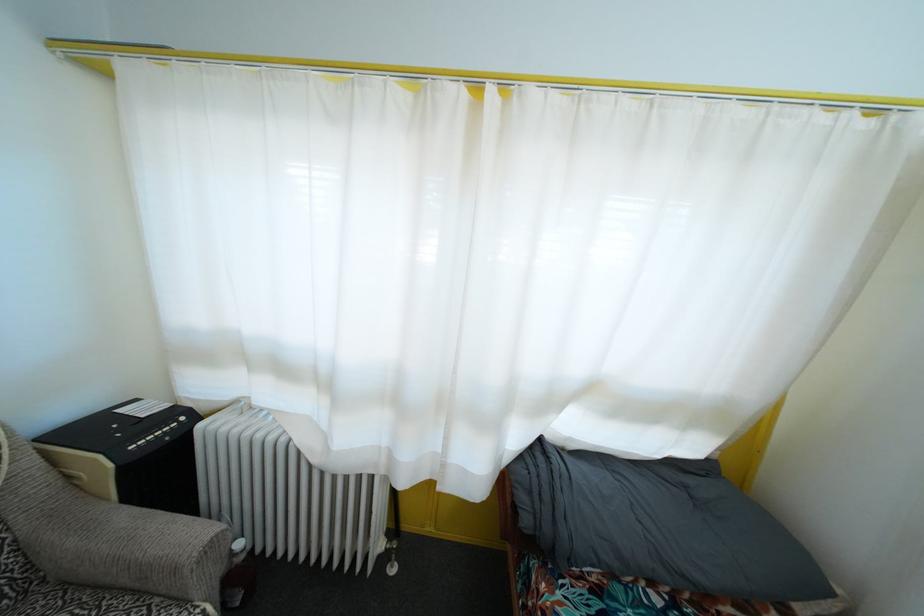
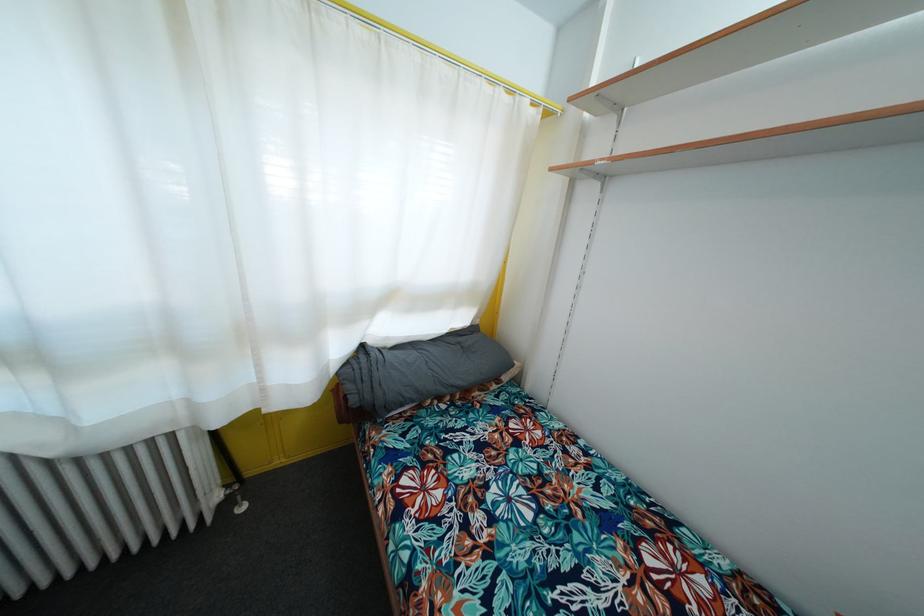
In the second image, find the point that corresponds to the point at 529,528 in the first image.

(358, 407)